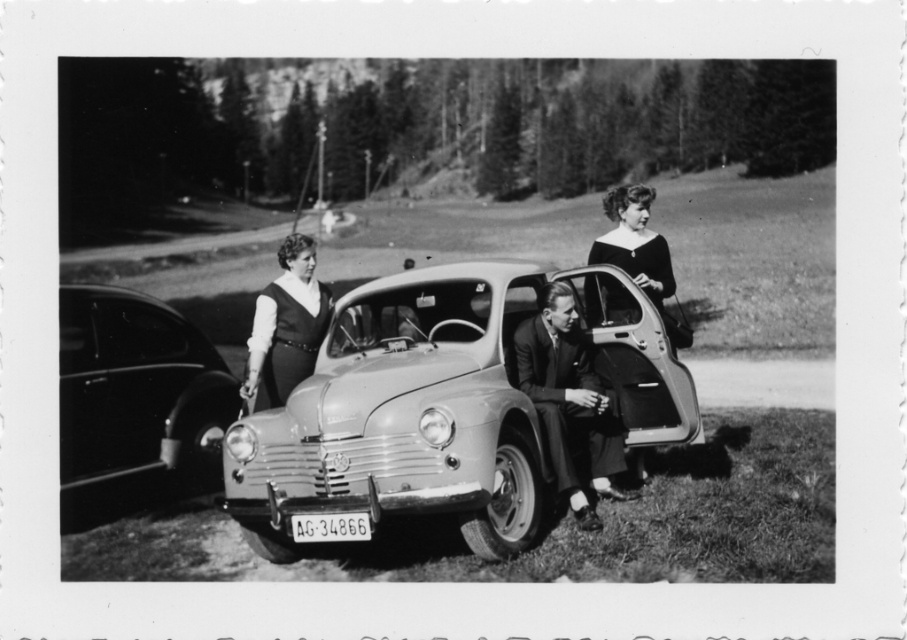
You are a photographer trying to capture a clear shot of both the shiny black car at left and the smooth suit jacket at center. Since you want to focus on the car first, where should you position the car relative to the jacket?

The shiny black car at left is positioned on the left side of the smooth suit jacket at center, so to focus on the car first, you should position the car to the left of the jacket.

You are standing at the point labeled as point (447, 404) in the image. What object are you touching?

The point (447, 404) is on the metallic gray car at center, so you are touching the metallic gray car at center.

You are standing in the middle of the image. There is a point at coordinates (135, 404). What object is located at that point?

The point at coordinates (135, 404) indicates a shiny black car at left.